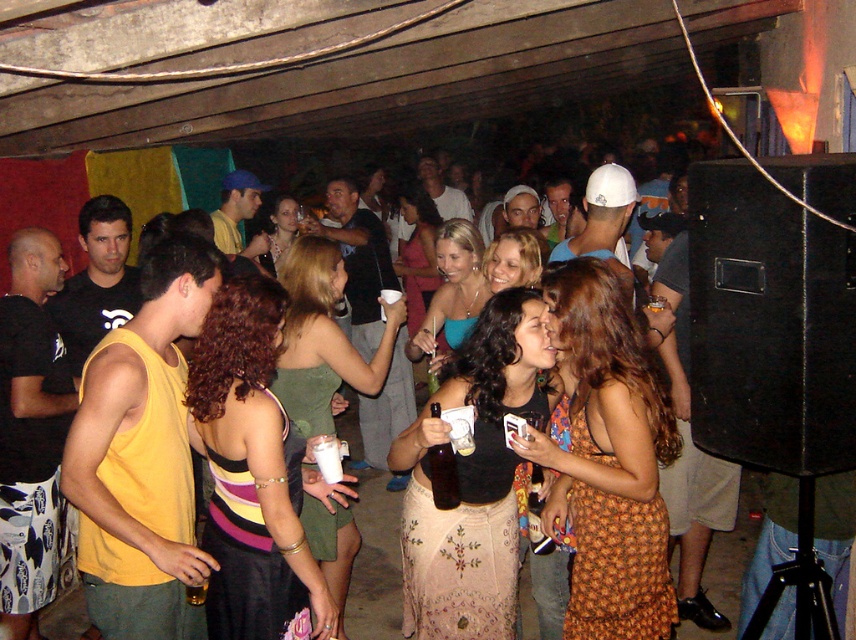
Question: Which of the following is the closest to the observer?

Choices:
 (A) matte black tank top at center
 (B) green satin dress at center

Answer: (A)

Question: From the image, what is the correct spatial relationship of orange printed dress at center in relation to matte blue tank top at center?

Choices:
 (A) left
 (B) right

Answer: (B)

Question: Is orange printed dress at center smaller than matte pink dress at center?

Choices:
 (A) no
 (B) yes

Answer: (B)

Question: Among these objects, which one is nearest to the camera?

Choices:
 (A) matte green dress at center
 (B) matte black tank top at center
 (C) green satin dress at center

Answer: (B)

Question: Can you confirm if striped fabric dress at center is bigger than matte blue tank top at center?

Choices:
 (A) yes
 (B) no

Answer: (B)

Question: Which point appears farthest from the camera in this image?

Choices:
 (A) (605, 376)
 (B) (476, 276)

Answer: (B)